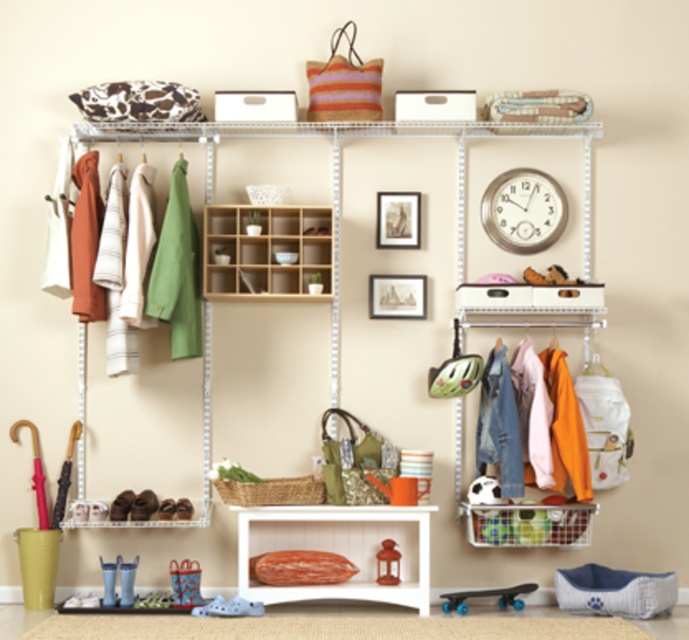
You are organizing the closet and need to place a new decorative item. The item is 10 cm thick. You have two options for placement on the metal wire shelving at upper center and the silver metallic clock at upper center. Which object allows for placing the item behind it without blocking the view of the other object?

The metal wire shelving at upper center is closer to the viewer than the silver metallic clock at upper center. Since the item is placed behind the metal wire shelving at upper center, it won???t block the view of the silver metallic clock at upper center which is further back. Therefore, placing the item behind the metal wire shelving at upper center is the better option.

You are standing in front of the closet and want to reach both the silver metallic clock at upper center and the matte red lantern at center. Which object will you need to stretch your arm further to reach?

You will need to stretch your arm further to reach the matte red lantern at center because it is positioned behind the silver metallic clock at upper center, making it farther away from you.

You are trying to hang a new coat in the closet. The coat requires a hook that is positioned higher than the metal wire shelving at upper center. Is there a hook available in the closet that meets this requirement?

The metal wire shelving at upper center is located at point (453, 220). Since the hooks are on the left side of the shelving unit and the shelving unit itself is at a specific coordinate, there is no mention of hooks above the shelving unit. Therefore, there is no hook available higher than the metal wire shelving at upper center to hang the coat.